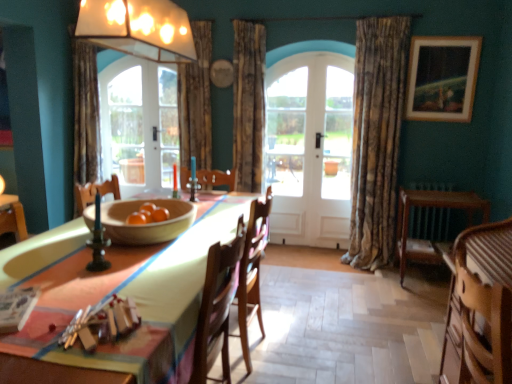
Question: Is textured beige curtain at right, positioned as the 3th curtain in left-to-right order, at the left side of wooden table at center?

Choices:
 (A) no
 (B) yes

Answer: (A)

Question: Does textured beige curtain at right, positioned as the 3th curtain in left-to-right order, appear on the right side of wooden table at center?

Choices:
 (A) yes
 (B) no

Answer: (A)

Question: Does textured beige curtain at right, positioned as the 3th curtain in left-to-right order, come in front of wooden table at center?

Choices:
 (A) no
 (B) yes

Answer: (A)

Question: Is textured beige curtain at right, positioned as the 3th curtain in left-to-right order, positioned beyond the bounds of wooden table at center?

Choices:
 (A) no
 (B) yes

Answer: (B)

Question: Does textured beige curtain at right, marked as the first curtain in a right-to-left arrangement, have a larger size compared to wooden table at center?

Choices:
 (A) yes
 (B) no

Answer: (B)

Question: Could you tell me if textured beige curtain at right, positioned as the 3th curtain in left-to-right order, is turned towards wooden table at center?

Choices:
 (A) no
 (B) yes

Answer: (A)

Question: Is clear glass door at center far away from white wooden door at center?

Choices:
 (A) yes
 (B) no

Answer: (B)

Question: Is clear glass door at center at the right side of white wooden door at center?

Choices:
 (A) no
 (B) yes

Answer: (A)

Question: Is white wooden door at center located within clear glass door at center?

Choices:
 (A) yes
 (B) no

Answer: (A)

Question: From a real-world perspective, is clear glass door at center located higher than white wooden door at center?

Choices:
 (A) no
 (B) yes

Answer: (A)

Question: Does clear glass door at center have a greater width compared to white wooden door at center?

Choices:
 (A) no
 (B) yes

Answer: (A)

Question: Can you confirm if clear glass door at center is shorter than white wooden door at center?

Choices:
 (A) yes
 (B) no

Answer: (A)

Question: Considering the relative sizes of clear glass door at center and wooden striped armchair at lower right in the image provided, is clear glass door at center smaller than wooden striped armchair at lower right?

Choices:
 (A) yes
 (B) no

Answer: (A)